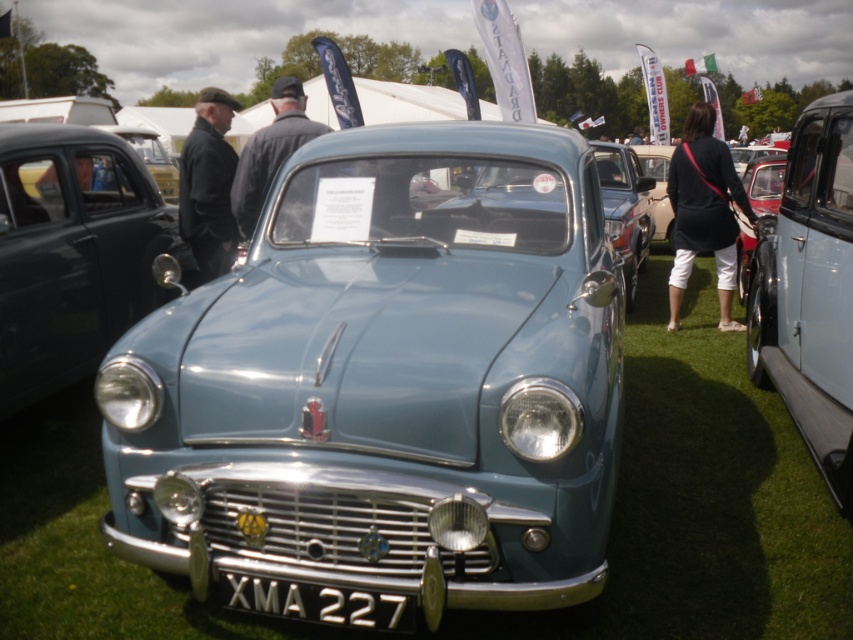
You are a photographer standing at the dark gray fabric jacket at upper left and want to take a photo of the dark blue fabric dress at center without moving the dress. Can you walk straight towards the dress to get a better angle?

The distance between the dark blue fabric dress at center and the dark gray fabric jacket at upper left is 4.44 meters, so yes, you can walk straight towards the dark blue fabric dress at center from the dark gray fabric jacket at upper left to get a better angle.

You are a photographer at the car show and need to position yourself to capture the light blue vintage car without any obstructions. There is a dark gray fabric jacket at upper left in the image. Based on its position, can you estimate where you should stand to avoid it blocking the car?

The dark gray fabric jacket at upper left is located at coordinates point (207, 184). To avoid it blocking the car, position yourself slightly to the right or lower than this point.

What is the position of the dark blue fabric dress at center relative to the dark gray fabric jacket at upper left in the image?

The dark blue fabric dress at center is positioned below the dark gray fabric jacket at upper left.